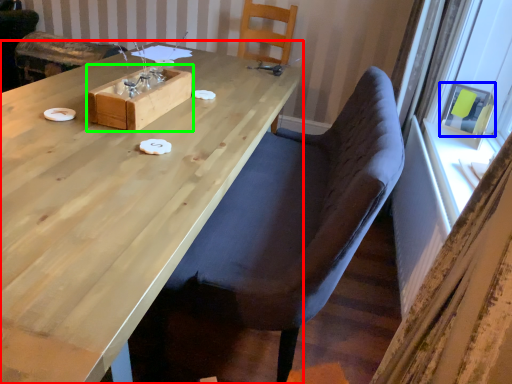
Question: Estimate the real-world distances between objects in this image. Which object is farther from table (highlighted by a red box), window screen (highlighted by a blue box) or box (highlighted by a green box)?

Choices:
 (A) window screen
 (B) box

Answer: (A)